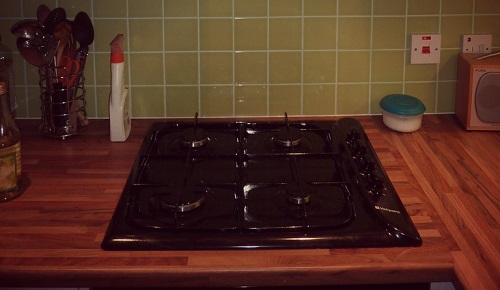
You are a GUI agent. You are given a task and a screenshot of the screen. Output one action in this format:
    pyautogui.click(x=<x>, y=<y>)
    Task: Click on the burners
    
    Given the screenshot: What is the action you would take?
    pyautogui.click(x=193, y=138), pyautogui.click(x=282, y=142), pyautogui.click(x=305, y=199), pyautogui.click(x=188, y=200)